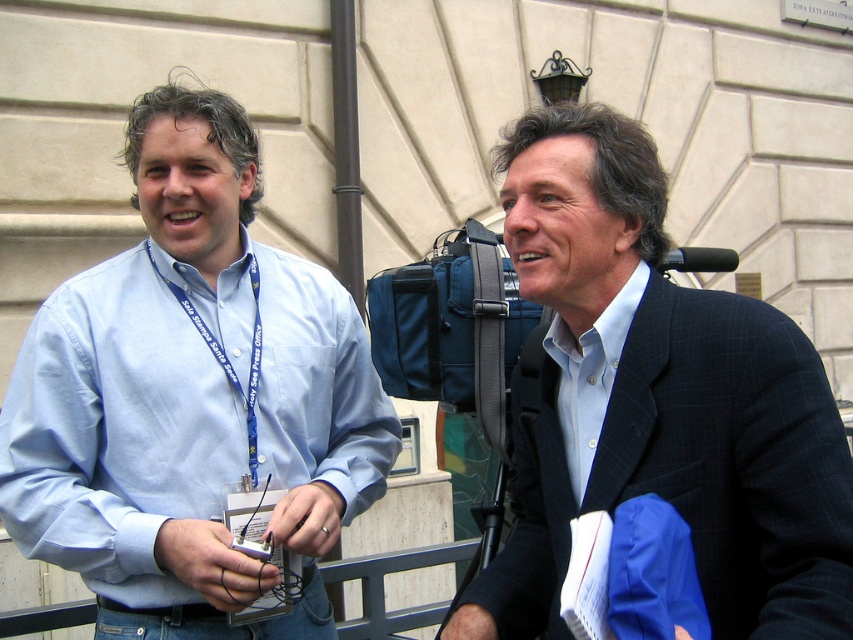
Between point (622, 304) and point (254, 484), which one is positioned in front?

Point (622, 304)

Is point (560, 372) positioned in front of point (254, 342)?

Yes, it is.

Where is `matte blue shirt at center`? The image size is (853, 640). matte blue shirt at center is located at coordinates (590, 374).

Is point (300, 452) behind point (573, 152)?

Yes, it is.

This screenshot has height=640, width=853. What do you see at coordinates (190, 397) in the screenshot? I see `light blue shirt at center` at bounding box center [190, 397].

You are a GUI agent. You are given a task and a screenshot of the screen. Output one action in this format:
    pyautogui.click(x=<x>, y=<y>)
    Task: Click on the light blue shirt at center
    
    Given the screenshot: What is the action you would take?
    pyautogui.click(x=190, y=397)

Is matte black suit at right to the left of blue fabric lanyard at left from the viewer's perspective?

No, matte black suit at right is not to the left of blue fabric lanyard at left.

Is point (708, 362) more distant than point (253, 396)?

No, (708, 362) is in front of (253, 396).

Where is `matte black suit at right`? This screenshot has width=853, height=640. matte black suit at right is located at coordinates (656, 403).